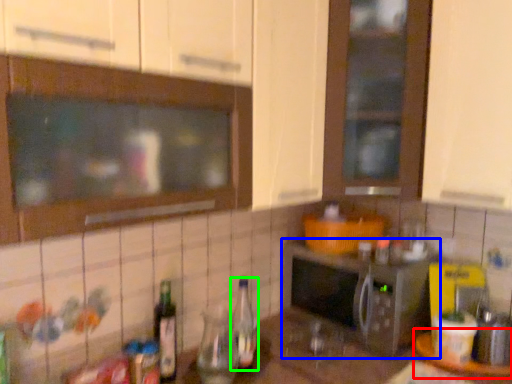
Question: Which is farther away from table (highlighted by a red box)? microwave oven (highlighted by a blue box) or bottle (highlighted by a green box)?

Choices:
 (A) microwave oven
 (B) bottle

Answer: (B)